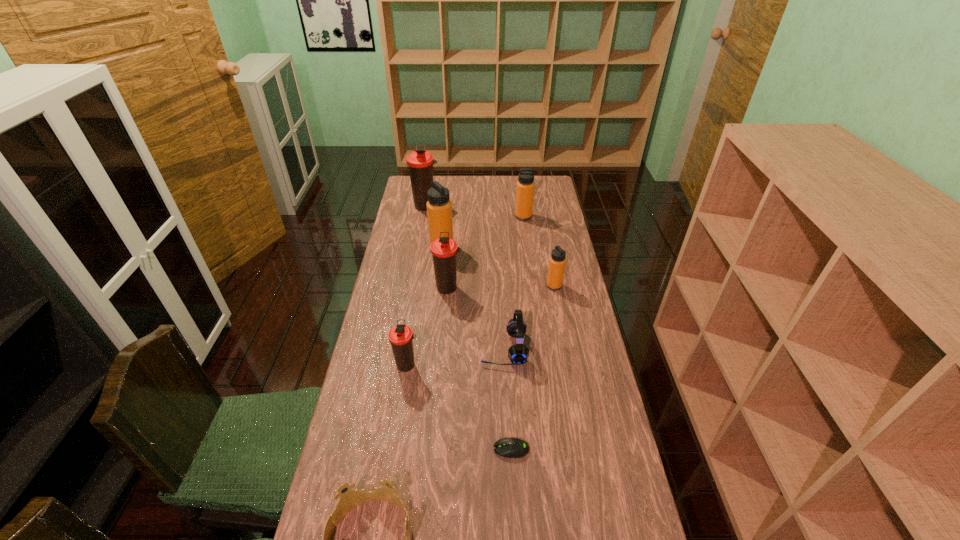
At what (x,y) coordinates should I click in order to perform the action: click on the smallest orange thermos bottle. Please return your answer as a coordinate pair (x, y). The image size is (960, 540). Looking at the image, I should click on (557, 261).

The height and width of the screenshot is (540, 960). I want to click on the third shortest object, so pos(518,353).

Identify the location of the eighth farthest object. (x=506, y=447).

Where is `computer mouse`? This screenshot has width=960, height=540. computer mouse is located at coordinates tap(506, 447).

Identify the location of free spot located on the front of the farthest brown thermos bottle. The image size is (960, 540). (418, 257).

The width and height of the screenshot is (960, 540). Identify the location of free point located on the back of the second nearest orange thermos bottle. (444, 221).

The width and height of the screenshot is (960, 540). What are the coordinates of `vacant space located 0.080m on the right of the second smallest orange thermos bottle` in the screenshot? It's located at (549, 217).

This screenshot has width=960, height=540. Identify the location of vacant space located on the back of the second biggest brown thermos bottle. (452, 239).

Find the location of a particular element. vacant area located 0.070m on the left of the smallest brown thermos bottle is located at coordinates (372, 365).

The image size is (960, 540). In order to click on vacant space positioned 0.080m on the back of the nearest orange thermos bottle in this screenshot , I will do `click(551, 267)`.